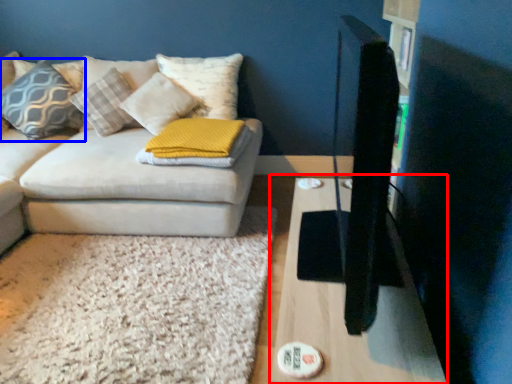
Question: Among these objects, which one is farthest to the camera, table (highlighted by a red box) or pillow (highlighted by a blue box)?

Choices:
 (A) table
 (B) pillow

Answer: (B)